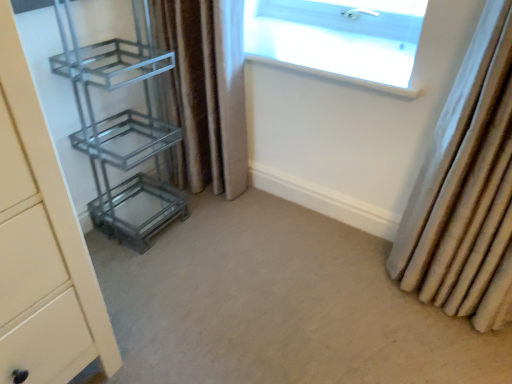
At what (x,y) coordinates should I click in order to perform the action: click on free space in front of metallic glass shelf at left. Please return your answer as a coordinate pair (x, y). The image size is (512, 384). Looking at the image, I should click on (154, 266).